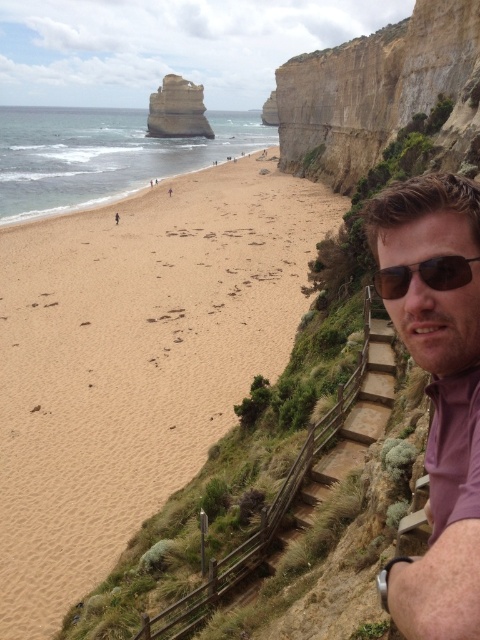
You are a photographer standing at the base of the wooden staircase on the beach. You want to capture a photo of the rustic stone arch at upper center. Considering the distance, do you think you can fit the entire arch into your camera frame without moving closer? Please explain your reasoning based on the given information.

The rustic stone arch at upper center is 1373.47 feet away from the camera. At this distance, it would be challenging to capture the entire arch in a single frame without moving closer, as most standard camera lenses have limited zoom capabilities to cover such a vast distance.

You are standing at the base of the wooden staircase on the beach and want to walk to the rustic stone arch at upper center. Which direction should you head towards, and will you pass over the brown sand at lower left?

To reach the rustic stone arch at upper center, you should head towards the upper center direction. Since the brown sand at lower left is closer to the viewer, you would be moving away from it, so you won